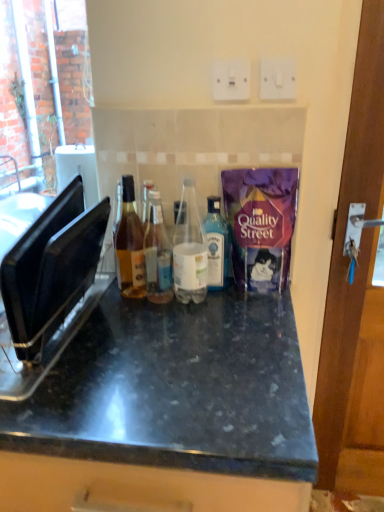
At what (x,y) coordinates should I click in order to perform the action: click on empty space that is ontop of black granite countertop at center (from a real-world perspective). Please return your answer as a coordinate pair (x, y). The width and height of the screenshot is (384, 512). Looking at the image, I should click on (140, 348).